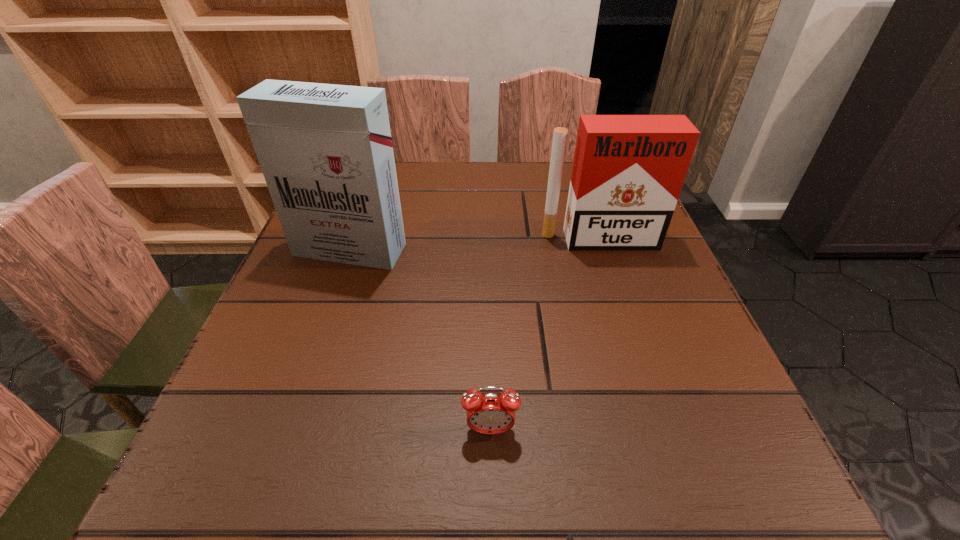
Locate an element on the screen. This screenshot has height=540, width=960. the leftmost object is located at coordinates (325, 150).

Locate an element on the screen. The width and height of the screenshot is (960, 540). the taller cigarette case is located at coordinates (325, 150).

The image size is (960, 540). Identify the location of the shorter cigarette case. (628, 170).

Find the location of a particular element. The width and height of the screenshot is (960, 540). the right cigarette case is located at coordinates point(628,170).

Image resolution: width=960 pixels, height=540 pixels. Find the location of `alarm clock`. alarm clock is located at coordinates (490, 413).

The image size is (960, 540). I want to click on the shortest object, so click(490, 413).

Find the location of a particular element. The height and width of the screenshot is (540, 960). vacant space located 0.280m on the right of the left cigarette case is located at coordinates coord(537,250).

I want to click on free space located 0.360m on the front-facing side of the rightmost object, so click(x=652, y=398).

The height and width of the screenshot is (540, 960). In order to click on vacant point located 0.050m on the face of the nearest object in this screenshot , I will do `click(492, 476)`.

At what (x,y) coordinates should I click in order to perform the action: click on object present at the left edge. Please return your answer as a coordinate pair (x, y). The width and height of the screenshot is (960, 540). Looking at the image, I should click on (325, 150).